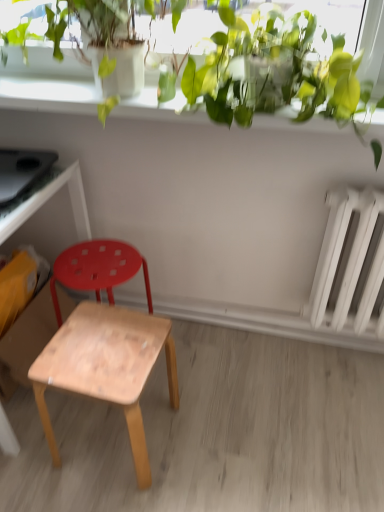
Find the location of `blank space to the left of natural wood stool at center, which is the second stool in back-to-front order`. blank space to the left of natural wood stool at center, which is the second stool in back-to-front order is located at coordinates (38, 444).